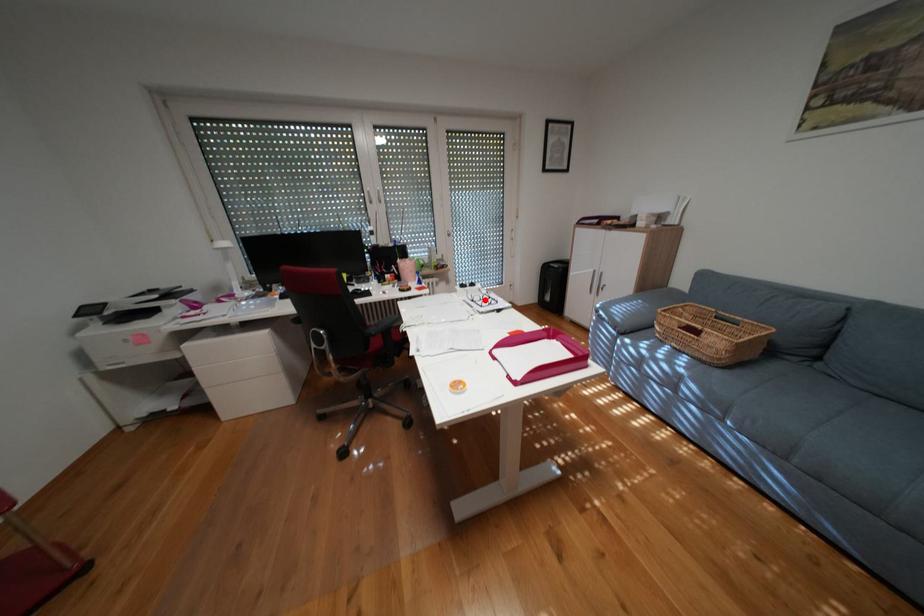
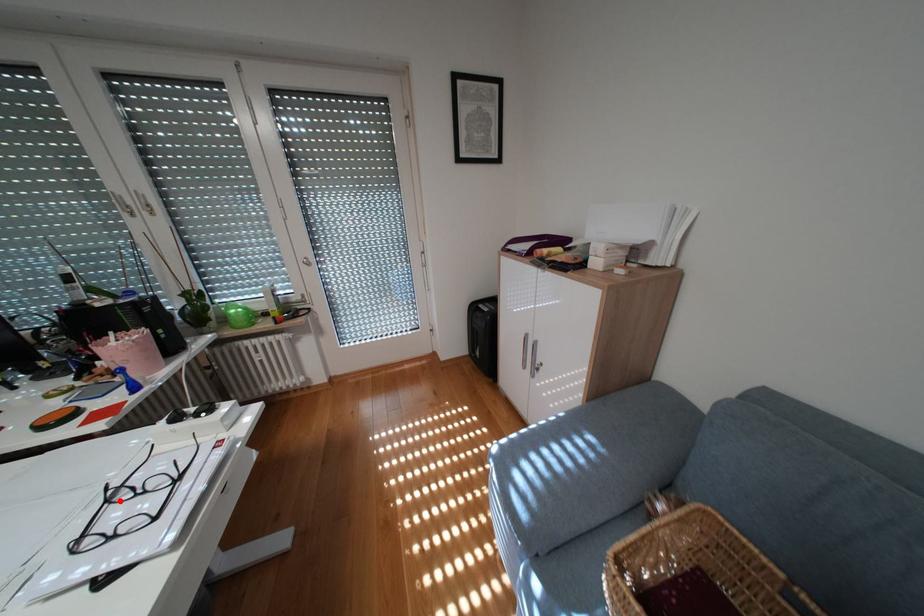
I am providing you with two images of the same scene from different viewpoints. A red point is marked on the first image and another point is marked on the second image. Is the marked point in image1 the same physical position as the marked point in image2?

Yes